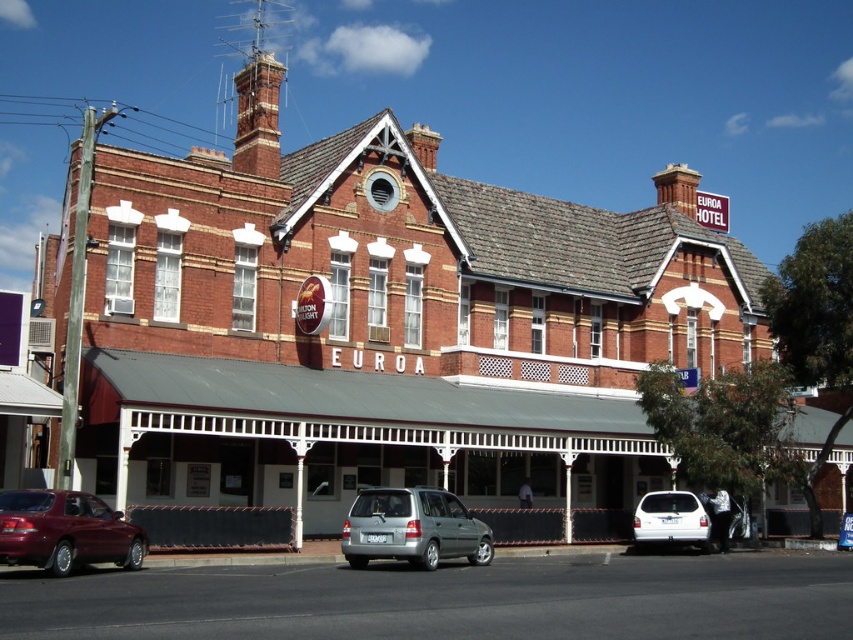
Question: Does shiny maroon sedan at lower left appear over white matte van at lower right?

Choices:
 (A) yes
 (B) no

Answer: (A)

Question: Which object appears closest to the camera in this image?

Choices:
 (A) white matte van at lower right
 (B) silver metallic minivan at center

Answer: (B)

Question: Among these points, which one is nearest to the camera?

Choices:
 (A) (131, 547)
 (B) (376, 528)

Answer: (A)

Question: Is silver metallic minivan at center positioned in front of white matte van at lower right?

Choices:
 (A) yes
 (B) no

Answer: (A)

Question: Among these points, which one is farthest from the camera?

Choices:
 (A) (680, 513)
 (B) (430, 488)

Answer: (A)

Question: Is shiny maroon sedan at lower left above white matte van at lower right?

Choices:
 (A) no
 (B) yes

Answer: (B)